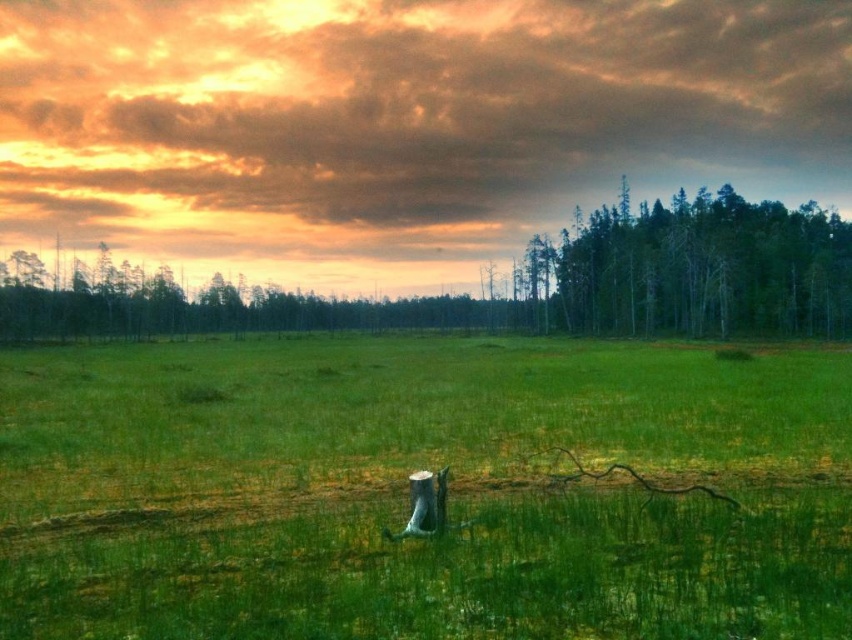
Is green grassy pasture at center above green matte trees at right?

Incorrect, green grassy pasture at center is not positioned above green matte trees at right.

Does green grassy pasture at center lie in front of green matte trees at right?

That is True.

The height and width of the screenshot is (640, 852). What are the coordinates of `green grassy pasture at center` in the screenshot? It's located at (407, 490).

Find the location of a particular element. This screenshot has height=640, width=852. green grassy pasture at center is located at coordinates (407, 490).